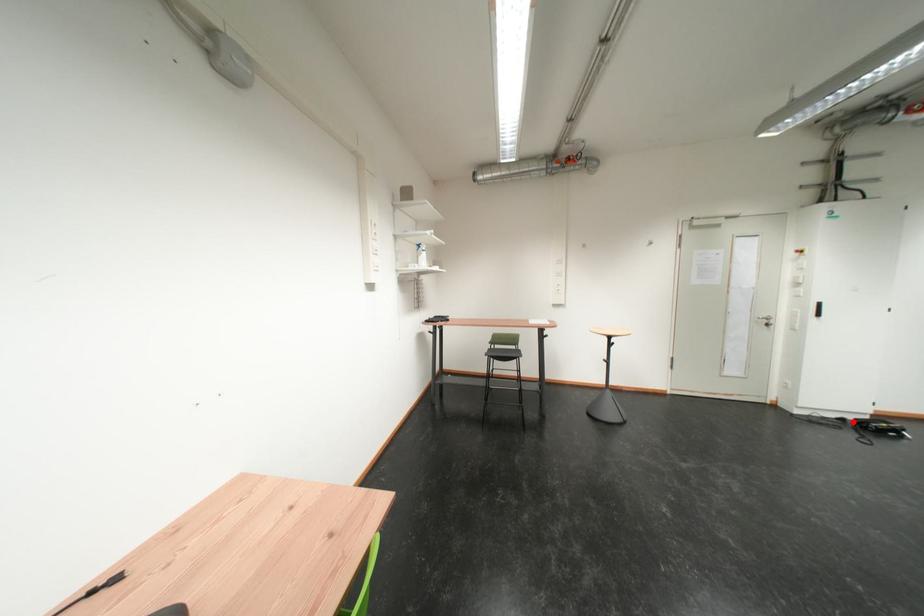
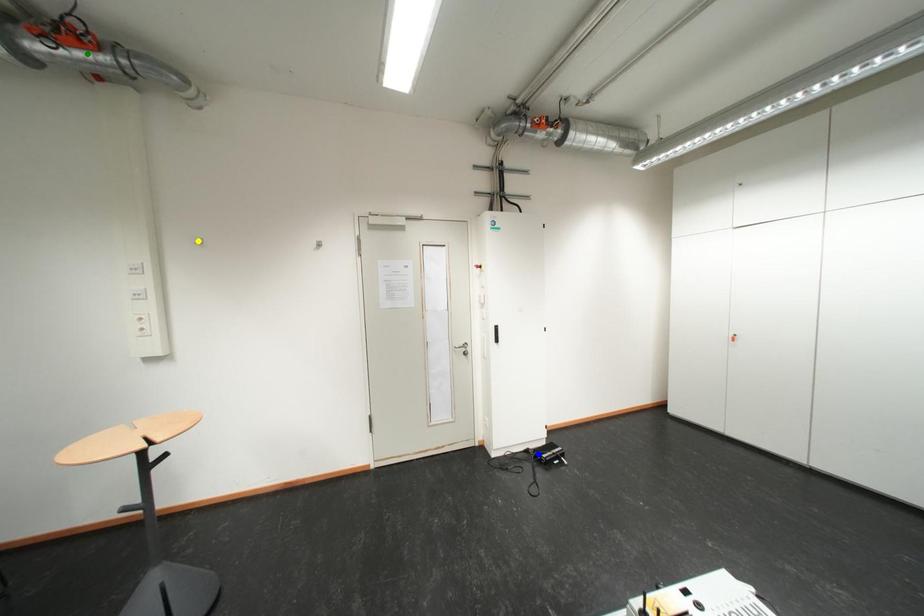
Question: I am providing you with two images of the same scene from different viewpoints. A red point is marked on the first image. You are given multiple points on the second image. Which point in image 2 represents the same 3d spot as the red point in image 1?

Choices:
 (A) blue point
 (B) yellow point
 (C) green point

Answer: (A)